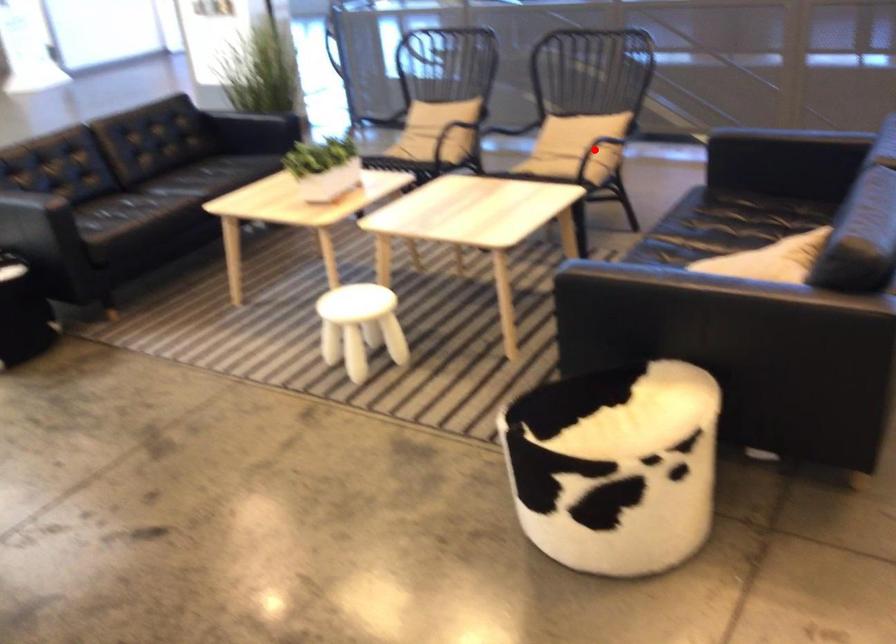
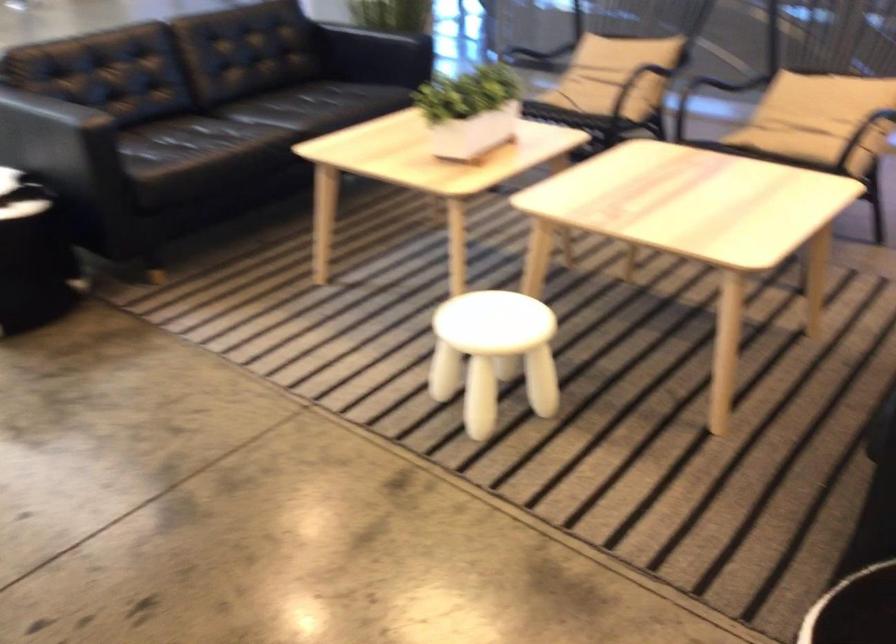
Question: I am providing you with two images of the same scene from different viewpoints. In image1, a red point is highlighted. Considering the same 3D point in image2, which of the following is correct?

Choices:
 (A) It is closer
 (B) It is farther

Answer: (A)